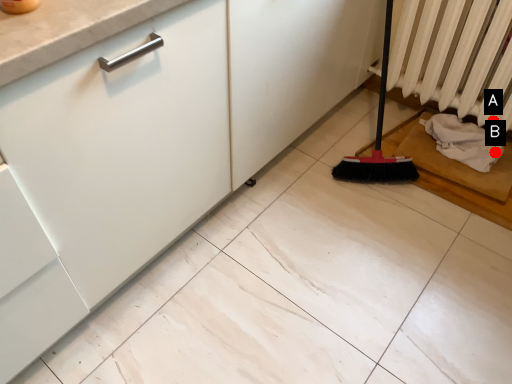
Question: Two points are circled on the image, labeled by A and B beside each circle. Which point is farther from the camera taking this photo?

Choices:
 (A) A is further
 (B) B is further

Answer: (B)